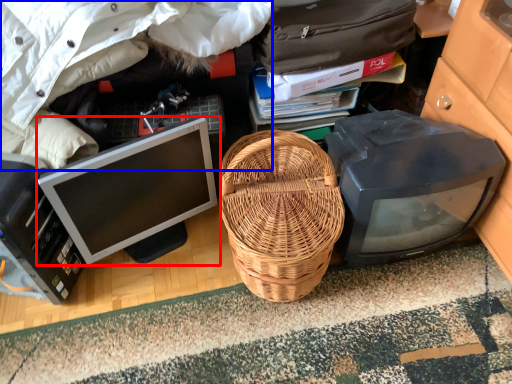
Question: Which object appears farthest to the camera in this image, computer monitor (highlighted by a red box) or clothing (highlighted by a blue box)?

Choices:
 (A) computer monitor
 (B) clothing

Answer: (A)